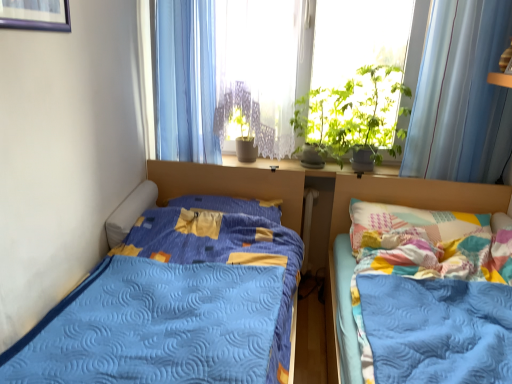
Question: Is blue sheer curtain at upper center, the 1th curtain when ordered from left to right, further to the viewer compared to white lace curtain at center?

Choices:
 (A) yes
 (B) no

Answer: (A)

Question: Could you tell me if blue sheer curtain at upper center, the second curtain in the right-to-left sequence, is turned towards white lace curtain at center?

Choices:
 (A) no
 (B) yes

Answer: (A)

Question: Is blue sheer curtain at upper center, the second curtain in the right-to-left sequence, thinner than white lace curtain at center?

Choices:
 (A) no
 (B) yes

Answer: (B)

Question: Considering the relative sizes of blue sheer curtain at upper center, the 1th curtain when ordered from left to right, and white lace curtain at center in the image provided, is blue sheer curtain at upper center, the 1th curtain when ordered from left to right, taller than white lace curtain at center?

Choices:
 (A) no
 (B) yes

Answer: (A)

Question: Does blue sheer curtain at upper center, the 1th curtain when ordered from left to right, appear on the right side of white lace curtain at center?

Choices:
 (A) yes
 (B) no

Answer: (B)

Question: Is white lace curtain at center located within blue sheer curtain at upper center, the 1th curtain when ordered from left to right?

Choices:
 (A) yes
 (B) no

Answer: (B)

Question: Could you tell me if white plastic radiator at center is facing green leafy plant at upper center?

Choices:
 (A) no
 (B) yes

Answer: (A)

Question: Is white plastic radiator at center taller than green leafy plant at upper center?

Choices:
 (A) no
 (B) yes

Answer: (A)

Question: Is white plastic radiator at center in contact with green leafy plant at upper center?

Choices:
 (A) no
 (B) yes

Answer: (A)

Question: Is white plastic radiator at center not close to green leafy plant at upper center?

Choices:
 (A) yes
 (B) no

Answer: (B)

Question: Considering the relative sizes of white plastic radiator at center and green leafy plant at upper center in the image provided, is white plastic radiator at center smaller than green leafy plant at upper center?

Choices:
 (A) no
 (B) yes

Answer: (B)

Question: Does white plastic radiator at center appear on the right side of green leafy plant at upper center?

Choices:
 (A) yes
 (B) no

Answer: (B)

Question: Considering the relative sizes of blue sheer curtain at upper center, the 1th curtain when ordered from left to right, and white plastic radiator at center in the image provided, is blue sheer curtain at upper center, the 1th curtain when ordered from left to right, bigger than white plastic radiator at center?

Choices:
 (A) yes
 (B) no

Answer: (A)